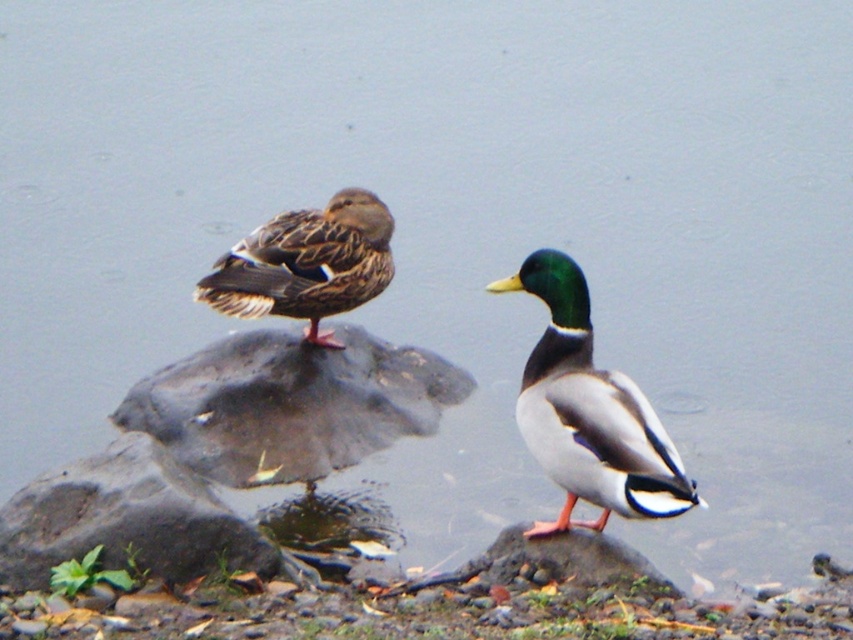
Can you confirm if gray rough rock at lower left is positioned above brown speckled feathers at center?

No, gray rough rock at lower left is not above brown speckled feathers at center.

Is gray rough rock at lower left shorter than brown speckled feathers at center?

Yes, gray rough rock at lower left is shorter than brown speckled feathers at center.

Does point (129, 545) lie in front of point (297, 212)?

Yes, point (129, 545) is closer to viewer.

Where is `gray rough rock at lower left`? This screenshot has width=853, height=640. gray rough rock at lower left is located at coordinates (126, 518).

Is green glossy duck at center to the left of gray rough rock at lower left from the viewer's perspective?

No, green glossy duck at center is not to the left of gray rough rock at lower left.

Find the location of a particular element. green glossy duck at center is located at coordinates (589, 412).

Between point (660, 440) and point (41, 483), which one is positioned behind?

The point (41, 483) is behind.

Find the location of a particular element. This screenshot has width=853, height=640. green glossy duck at center is located at coordinates (589, 412).

Is brown speckled feathers at center above smooth gray rock at center?

Yes.

You are a GUI agent. You are given a task and a screenshot of the screen. Output one action in this format:
    pyautogui.click(x=<x>, y=<y>)
    Task: Click on the brown speckled feathers at center
    Image resolution: width=853 pixels, height=640 pixels.
    Given the screenshot: What is the action you would take?
    pyautogui.click(x=306, y=262)